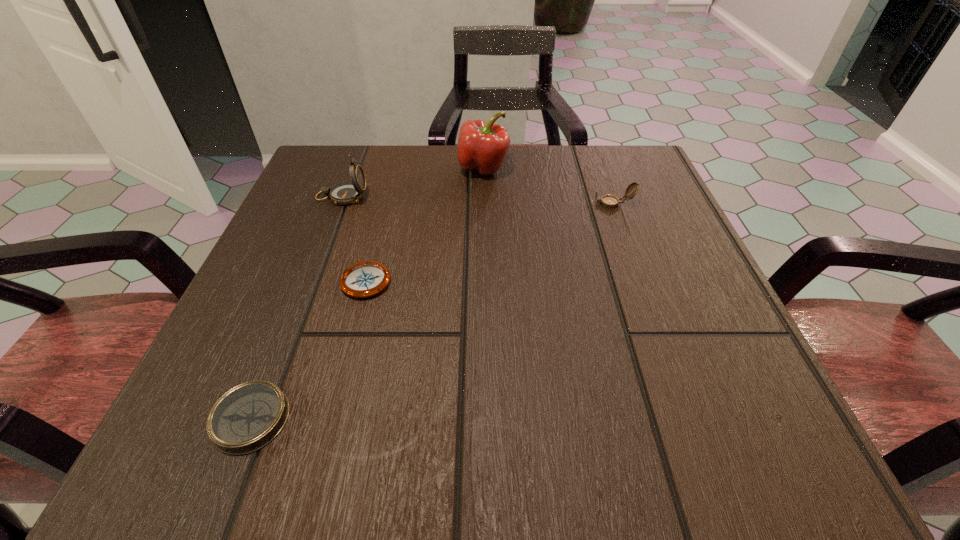
Identify the location of free location that satisfies the following two spatial constraints: 1. on the face of the second tallest compass; 2. on the front side of the second nearest object. (640, 280).

You are a GUI agent. You are given a task and a screenshot of the screen. Output one action in this format:
    pyautogui.click(x=<x>, y=<y>)
    Task: Click on the free spot that satisfies the following two spatial constraints: 1. on the face of the fourth shortest object; 2. on the back side of the second nearest compass
    The width and height of the screenshot is (960, 540).
    Given the screenshot: What is the action you would take?
    pyautogui.click(x=310, y=280)

Locate an element on the screen. This screenshot has width=960, height=540. free location that satisfies the following two spatial constraints: 1. on the face of the third tallest object; 2. on the front side of the nearest compass is located at coordinates (690, 418).